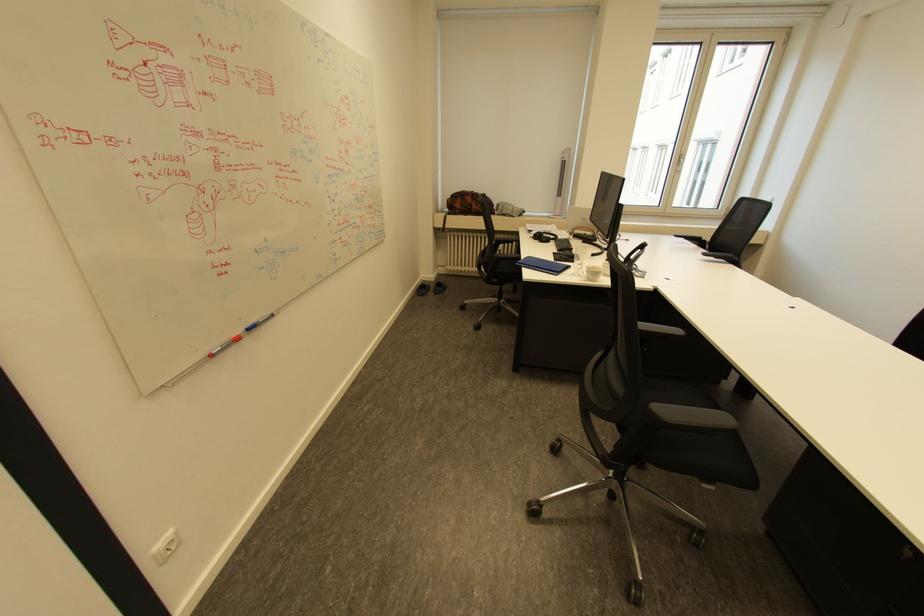
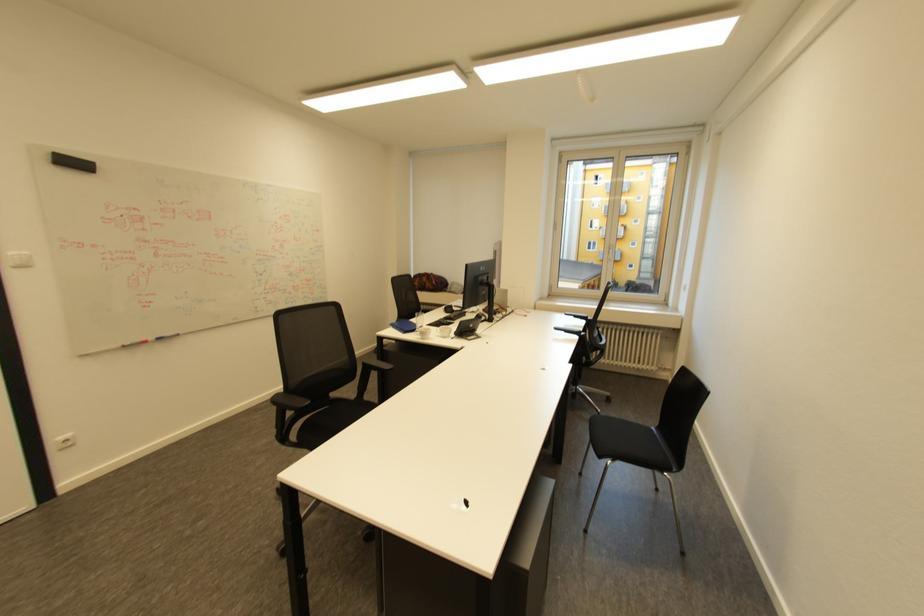
Where in the second image is the point corresponding to pixel 719 257 from the first image?

(570, 333)